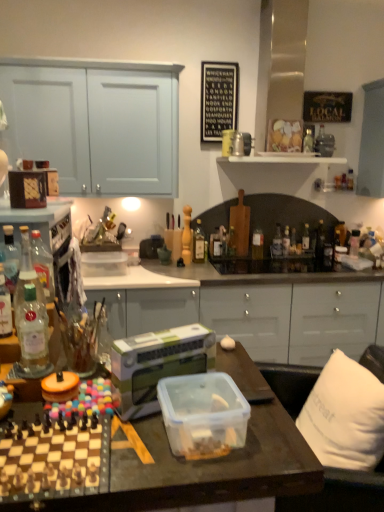
At what (x,y) coordinates should I click in order to perform the action: click on free location in front of clear glass bottle at right, placed as the 12th bottle when sorted from left to right. Please return your answer as a coordinate pair (x, y). Looking at the image, I should click on (302, 264).